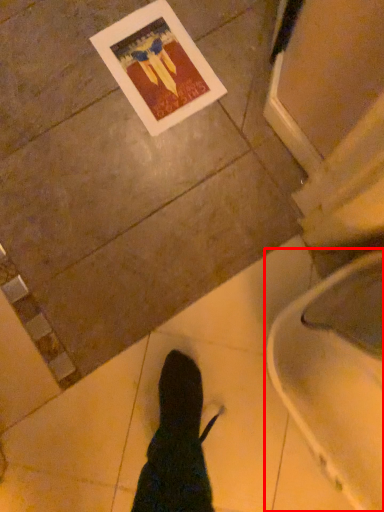
Question: In this image, where is toilet (annotated by the red box) located relative to postcard?

Choices:
 (A) right
 (B) left

Answer: (A)